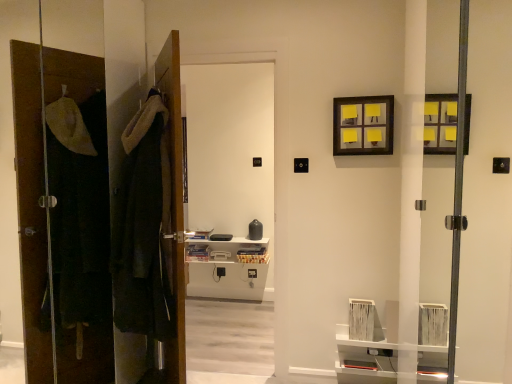
Question: Looking at their shapes, would you say brown wooden door at left, which appears as the second door when viewed from the right, is wider or thinner than white glossy door at center?

Choices:
 (A) wide
 (B) thin

Answer: (B)

Question: Choose the correct answer: Is brown wooden door at left, marked as the first door in a left-to-right arrangement, inside white glossy door at center or outside it?

Choices:
 (A) outside
 (B) inside

Answer: (A)

Question: Considering the real-world distances, which object is farthest from the velvet-like dark green robe at left?

Choices:
 (A) brown wooden door at left, which appears as the second door when viewed from the right
 (B) white glossy door at center
 (C) wooden door at center, acting as the 1th door starting from the right
 (D) matte black picture frame at upper right

Answer: (B)

Question: Estimate the real-world distances between objects in this image. Which object is closer to the velvet-like dark green robe at left?

Choices:
 (A) brown wooden door at left, marked as the first door in a left-to-right arrangement
 (B) white glossy door at center
 (C) wooden door at center, acting as the 1th door starting from the right
 (D) matte black picture frame at upper right

Answer: (C)